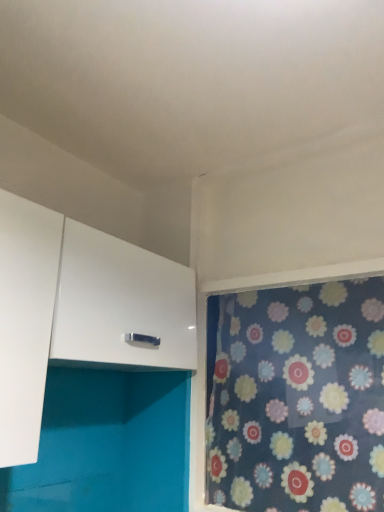
Question: Is floral fabric curtain at right bigger or smaller than white glossy cabinet at upper left?

Choices:
 (A) small
 (B) big

Answer: (A)

Question: From the image's perspective, is floral fabric curtain at right located above or below white glossy cabinet at upper left?

Choices:
 (A) above
 (B) below

Answer: (B)

Question: Relative to white glossy cabinet at upper left, is floral fabric curtain at right in front or behind?

Choices:
 (A) front
 (B) behind

Answer: (B)

Question: From a real-world perspective, is white glossy cabinet at upper left above or below floral fabric curtain at right?

Choices:
 (A) above
 (B) below

Answer: (A)

Question: Is white glossy cabinet at upper left inside the boundaries of floral fabric curtain at right, or outside?

Choices:
 (A) inside
 (B) outside

Answer: (B)

Question: Is white glossy cabinet at upper left in front of or behind floral fabric curtain at right in the image?

Choices:
 (A) front
 (B) behind

Answer: (A)

Question: Is point (77, 242) closer or farther from the camera than point (216, 461)?

Choices:
 (A) farther
 (B) closer

Answer: (B)